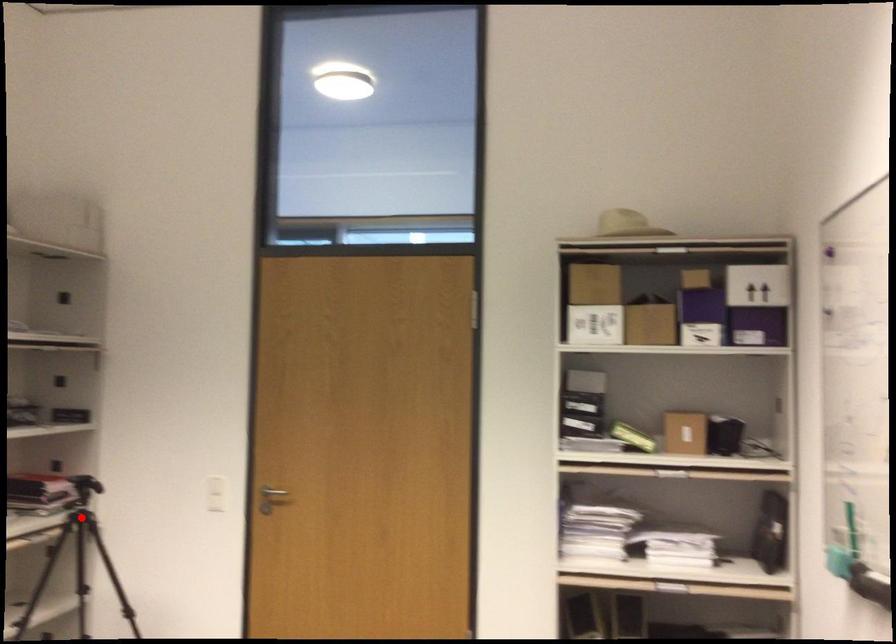
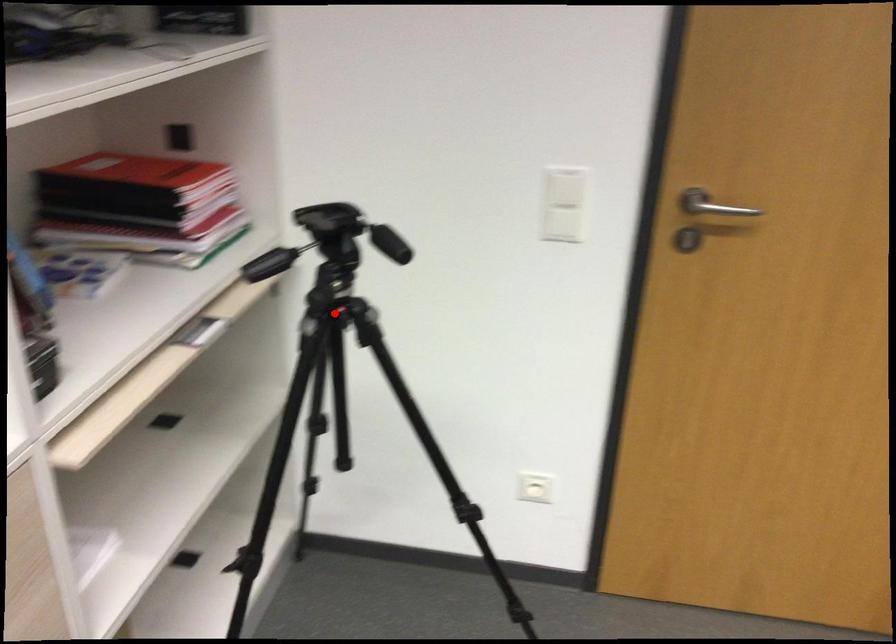
I am providing you with two images of the same scene from different viewpoints. A red point is marked on the first image and another point is marked on the second image. Are the points marked in image1 and image2 representing the same 3D position?

Yes